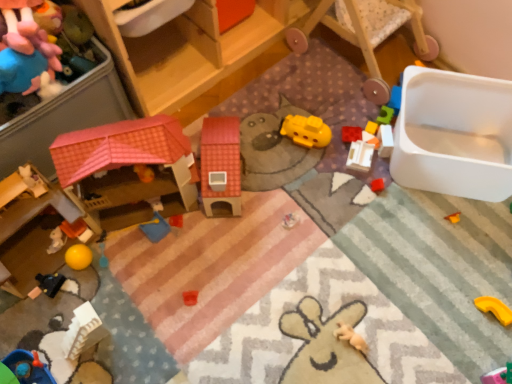
Identify the location of vacant space that's between rubber brick at upper right, placed as the 7th toy when sorted from left to right, and light brown plush toy at lower right, which appears as the 6th toy when viewed from the left. The width and height of the screenshot is (512, 384). (348, 243).